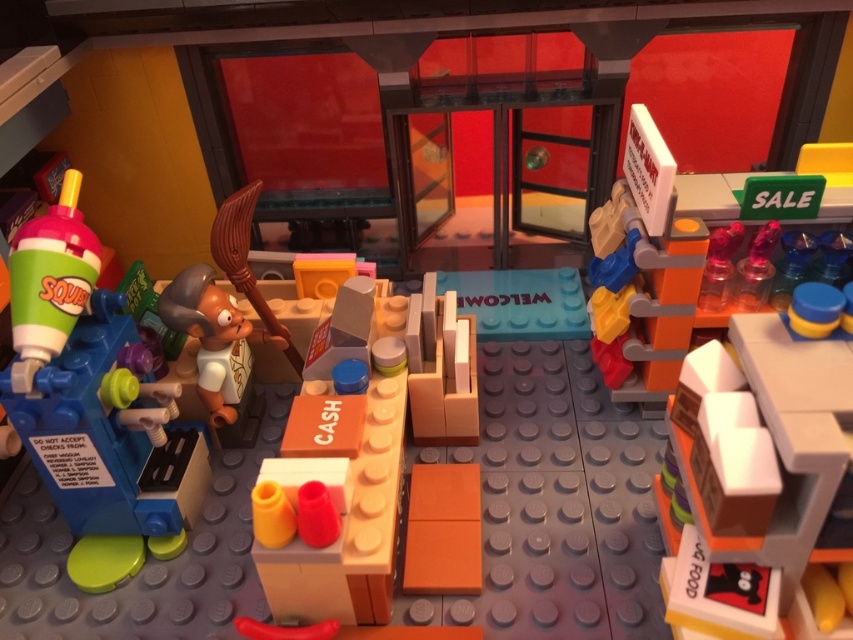
In the LEGO diorama of the convenience store, there is a matte plastic soda machine at left and an orange matte cash register at center. Which object is taller?

The matte plastic soda machine at left is taller than the orange matte cash register at center.